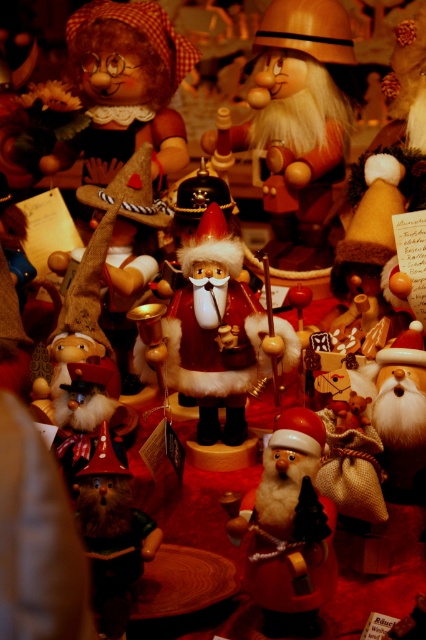
Question: Which object appears farthest from the camera in this image?

Choices:
 (A) wooden gnome at center
 (B) fuzzy red santa at center

Answer: (A)

Question: Is fuzzy red santa at center below wooden gnome at center?

Choices:
 (A) yes
 (B) no

Answer: (B)

Question: Considering the relative positions of fuzzy red santa at center and wooden gnome at center in the image provided, where is fuzzy red santa at center located with respect to wooden gnome at center?

Choices:
 (A) left
 (B) right

Answer: (B)

Question: Which of the following is the closest to the observer?

Choices:
 (A) (252, 541)
 (B) (134, 528)

Answer: (A)

Question: Observing the image, what is the correct spatial positioning of fuzzy red santa at center in reference to wooden gnome at center?

Choices:
 (A) below
 (B) above

Answer: (B)

Question: Among these objects, which one is nearest to the camera?

Choices:
 (A) wooden gnome at center
 (B) fuzzy red santa at center

Answer: (B)